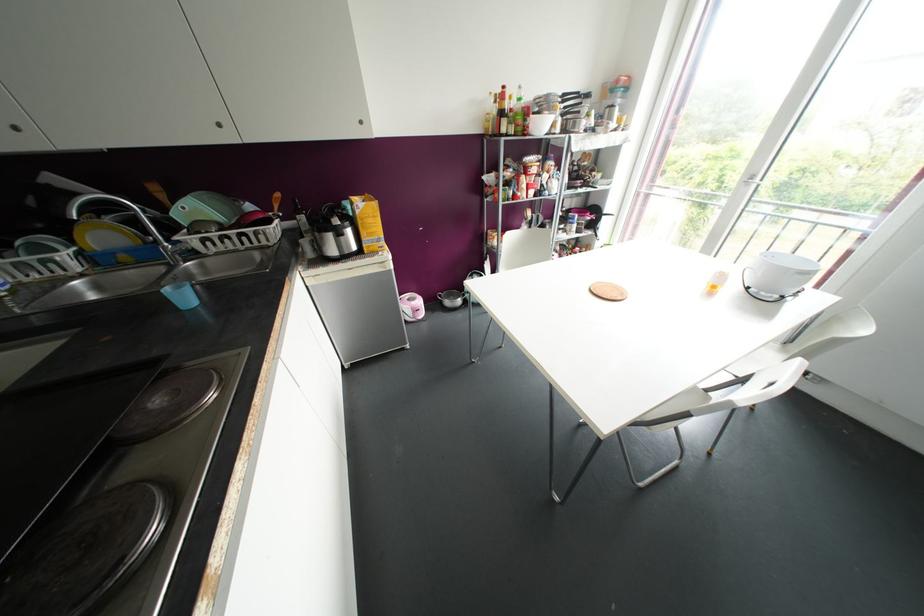
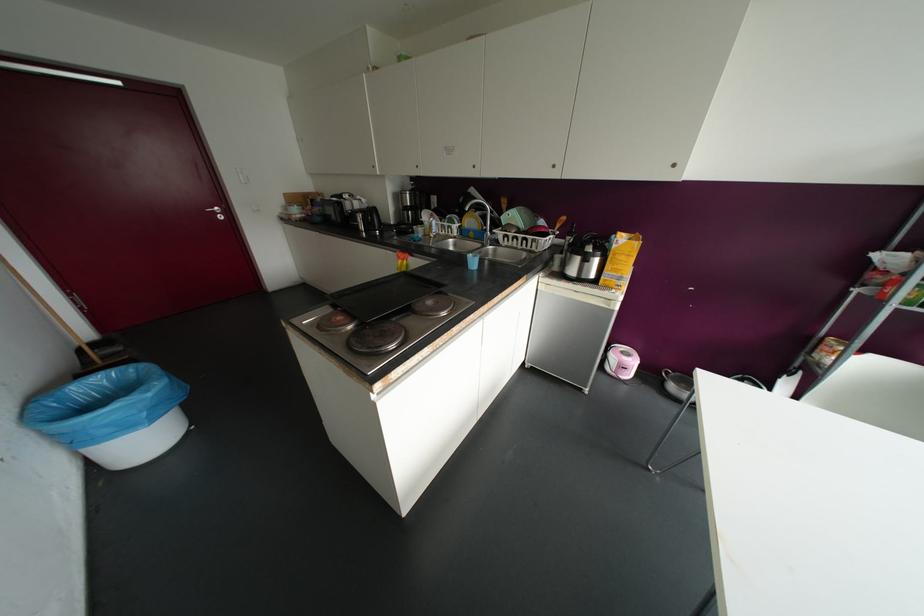
Where in the second image is the point corresponding to the point at 360,122 from the first image?

(673, 164)